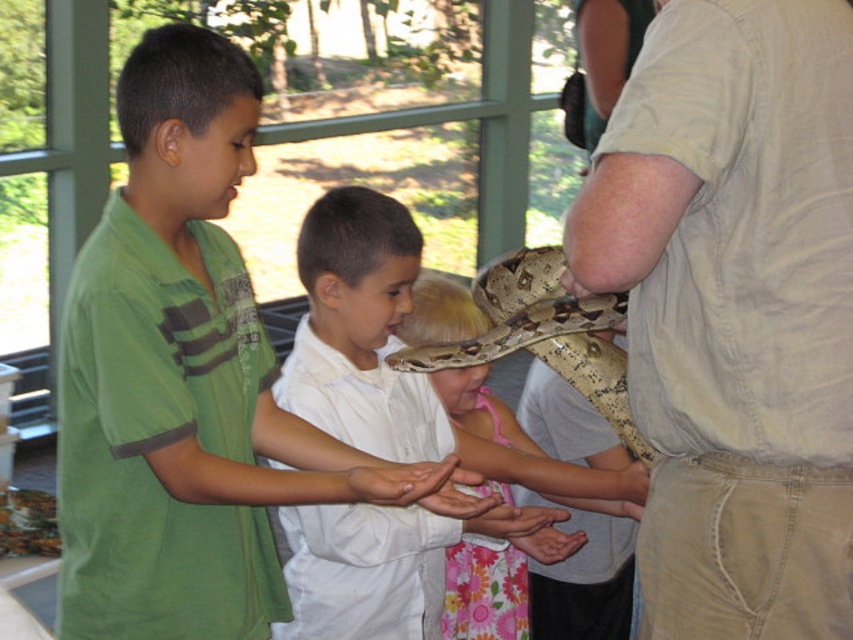
Looking at this image, is smooth white shirt at center closer to the viewer compared to smooth beige snake at center?

Yes, smooth white shirt at center is in front of smooth beige snake at center.

Is point (407, 637) positioned behind point (515, 564)?

That is False.

Who is more forward, (355, 442) or (448, 582)?

Point (355, 442) is more forward.

Identify the location of smooth white shirt at center. The image size is (853, 640). (397, 371).

Can you confirm if smooth beige snake at center is shorter than green matte neck at left?

Incorrect, smooth beige snake at center's height does not fall short of green matte neck at left's.

Who is taller, smooth beige snake at center or green matte neck at left?

smooth beige snake at center is taller.

This screenshot has width=853, height=640. I want to click on smooth beige snake at center, so click(x=496, y=584).

At what (x,y) coordinates should I click in order to perform the action: click on green matte shirt at left. Please return your answer as a coordinate pair (x, y). Image resolution: width=853 pixels, height=640 pixels. Looking at the image, I should click on (184, 384).

Which is below, green matte shirt at left or brown scaly snake at center?

green matte shirt at left

Image resolution: width=853 pixels, height=640 pixels. Describe the element at coordinates (184, 384) in the screenshot. I see `green matte shirt at left` at that location.

Find the location of a particular element. green matte shirt at left is located at coordinates (184, 384).